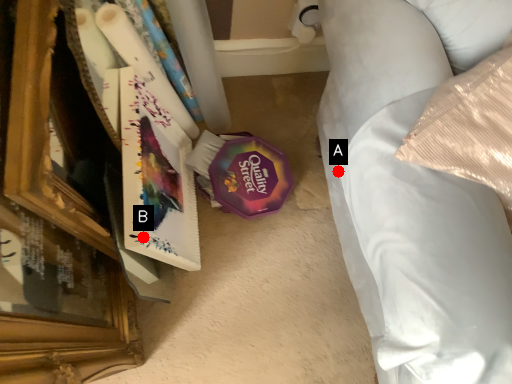
Question: Two points are circled on the image, labeled by A and B beside each circle. Among these points, which one is nearest to the camera?

Choices:
 (A) A is closer
 (B) B is closer

Answer: (A)